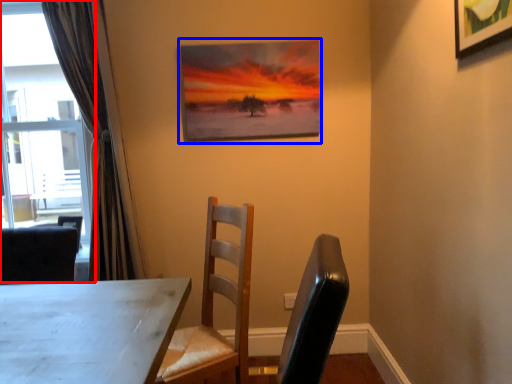
Question: Which point is closer to the camera, window (highlighted by a red box) or picture frame (highlighted by a blue box)?

Choices:
 (A) window
 (B) picture frame

Answer: (A)